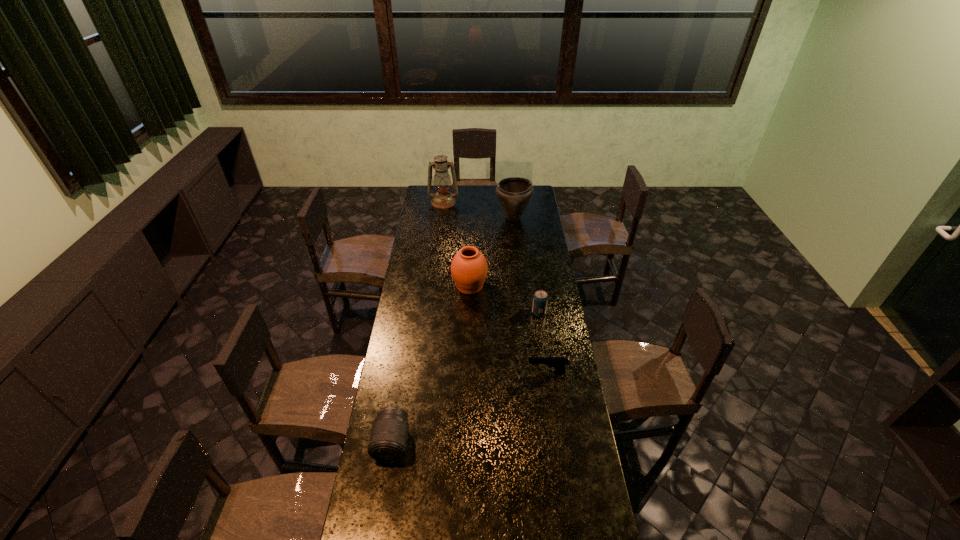
This screenshot has height=540, width=960. Find the location of `the tallest object`. the tallest object is located at coordinates (443, 199).

Find the location of a particular element. The width and height of the screenshot is (960, 540). the farther urn is located at coordinates (514, 193).

Find the location of a particular element. The height and width of the screenshot is (540, 960). the nearer urn is located at coordinates (469, 268).

I want to click on the third farthest object, so click(x=469, y=268).

I want to click on telephoto lens, so click(388, 441).

Image resolution: width=960 pixels, height=540 pixels. Identify the location of pop soda. (540, 299).

The image size is (960, 540). Identify the location of the shortest object. (559, 363).

At what (x,y) coordinates should I click in order to perform the action: click on pistol. Please return your answer as a coordinate pair (x, y). This screenshot has width=960, height=540. Looking at the image, I should click on (559, 363).

The width and height of the screenshot is (960, 540). I want to click on free region located on the right of the oil lamp, so tap(476, 202).

Locate an element on the screen. Image resolution: width=960 pixels, height=540 pixels. vacant space located 0.050m on the back of the right urn is located at coordinates (512, 204).